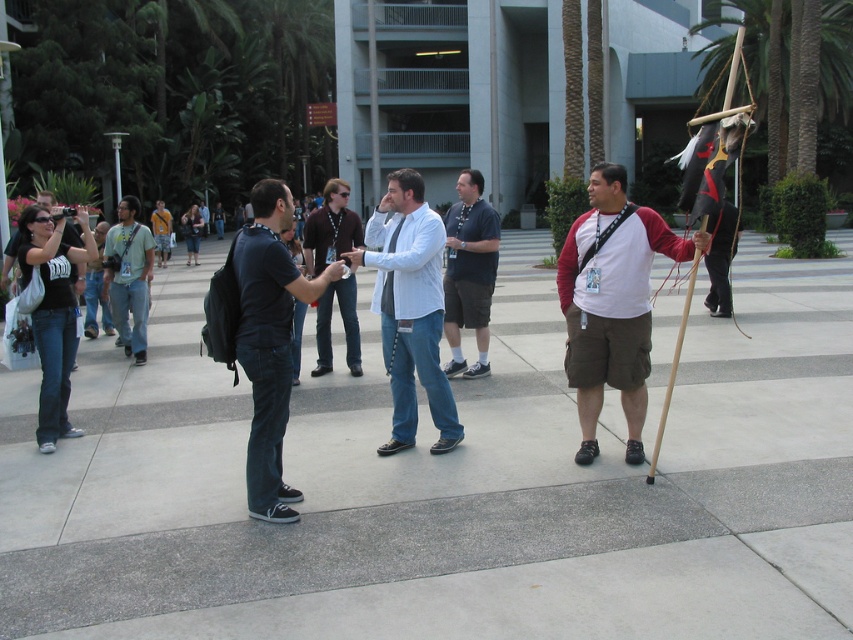
How far apart are matte white shirt at center and matte black camera at left?

They are 4.56 meters apart.

Which of these two, matte white shirt at center or matte black camera at left, stands taller?

matte black camera at left

Who is more forward, (564, 276) or (68, 241)?

Point (564, 276) is in front.

Identify the location of matte white shirt at center. (612, 304).

Who is taller, matte black camera at left or yellow t-shirt at center?

Standing taller between the two is matte black camera at left.

Does point (74, 236) come behind point (155, 243)?

No, it is in front of (155, 243).

The image size is (853, 640). Identify the location of matte black camera at left. (76, 280).

Find the location of a particular element. matte black camera at left is located at coordinates (76, 280).

Which is behind, point (247, 228) or point (78, 269)?

The point (78, 269) is more distant.

Where is `dark blue jeans at center`? The height and width of the screenshot is (640, 853). dark blue jeans at center is located at coordinates (270, 340).